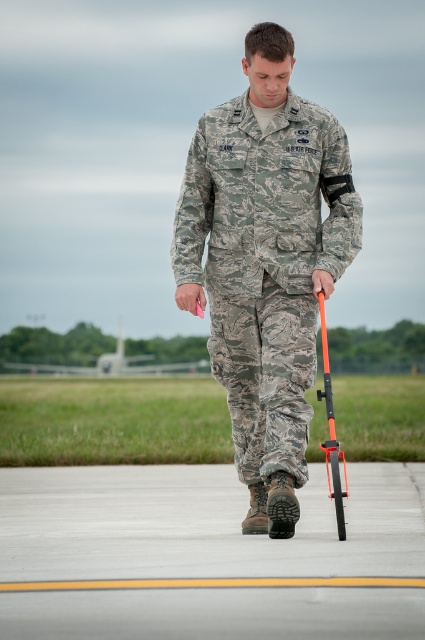
You are a maintenance worker on an airfield. You need to place a 2.5 meters long safety barrier between the gray concrete tarmac at center and the camouflage fabric uniform at center. Is there enough space to place it?

The distance between the gray concrete tarmac at center and the camouflage fabric uniform at center is 2.08 meters. Since the safety barrier is 2.5 meters long, which is longer than the available space, it cannot be placed between them.

You are a drone operator flying above an airfield. You notice two objects at the center of your viewfinder. One is the gray concrete tarmac at center and the other is the camouflage fabric uniform at center. Which object is closer to the drone?

The gray concrete tarmac at center is closer to the drone because the camouflage fabric uniform at center is behind it.

You are a drone operator trying to navigate a drone between two points in the image. The points are labeled as point 1 at coordinates point (34, 484) and point 2 at coordinates point (331, 461). Based on the scene, which point is closer to you, the operator?

Point 1 at coordinates point (34, 484) is closer to you than point 2 at coordinates point (331, 461) because the description states that point (34, 484) is further to the viewer than point (331, 461).